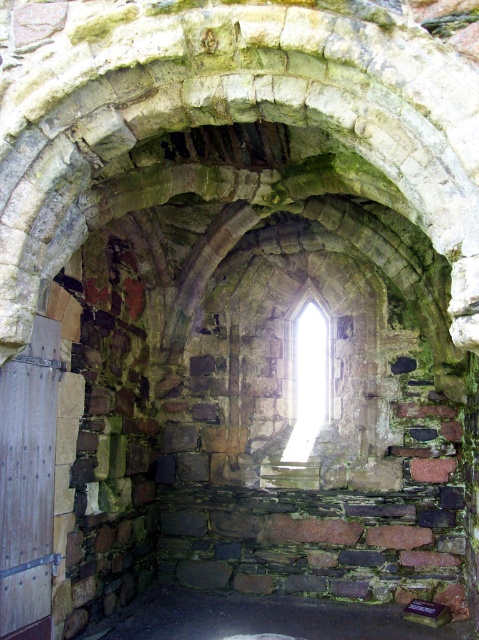
Question: Which point is farther from the camera taking this photo?

Choices:
 (A) [330, 616]
 (B) [6, 397]

Answer: (A)

Question: Is wooden door at left above dark stone floor at center?

Choices:
 (A) no
 (B) yes

Answer: (B)

Question: Which point is farther to the camera?

Choices:
 (A) wooden door at left
 (B) dark stone floor at center
 (C) clear glass window at center

Answer: (C)

Question: Is wooden door at left smaller than dark stone floor at center?

Choices:
 (A) no
 (B) yes

Answer: (B)

Question: Which object is the farthest from the clear glass window at center?

Choices:
 (A) wooden door at left
 (B) dark stone floor at center

Answer: (A)

Question: Does wooden door at left lie behind dark stone floor at center?

Choices:
 (A) yes
 (B) no

Answer: (B)